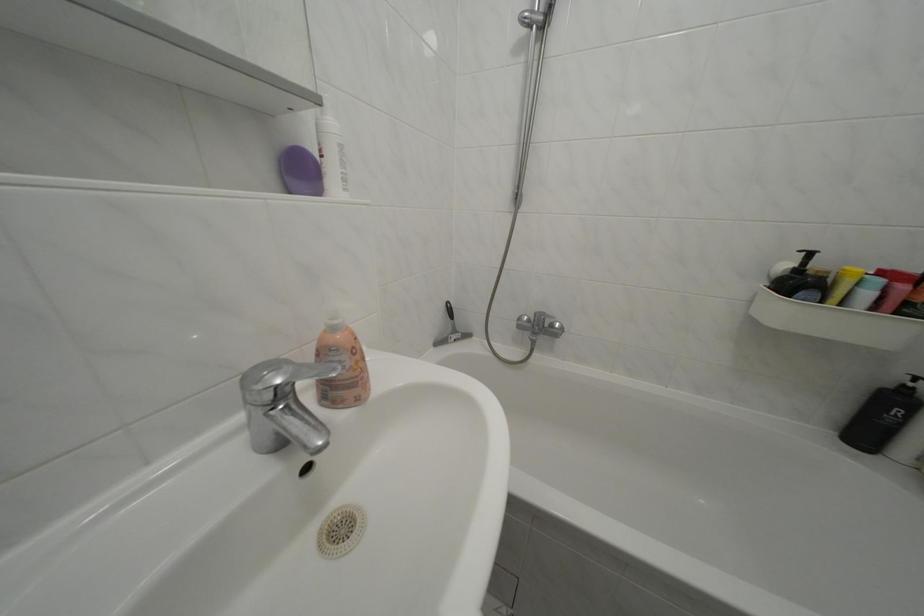
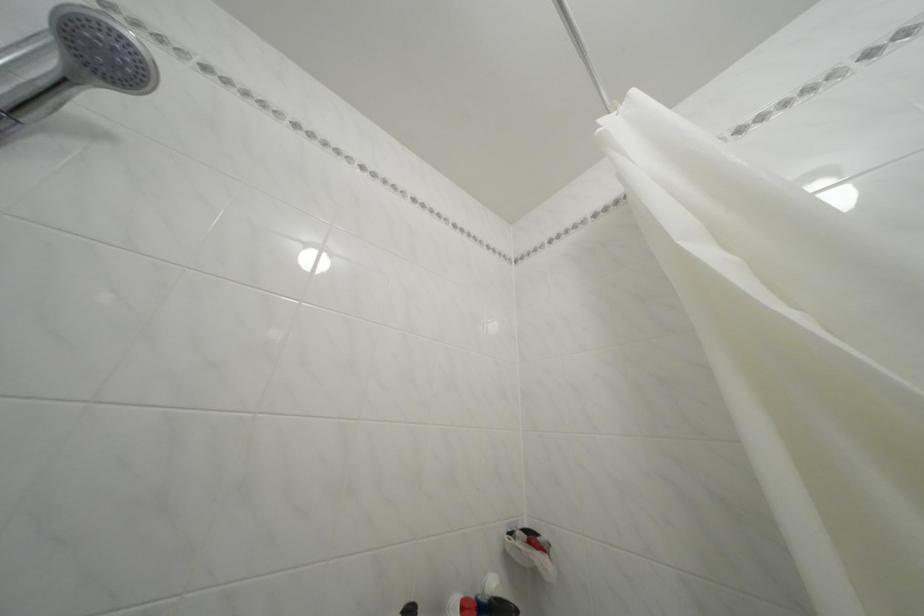
Based on the continuous images, in which direction is the camera rotating?

The camera rotated toward right-up.